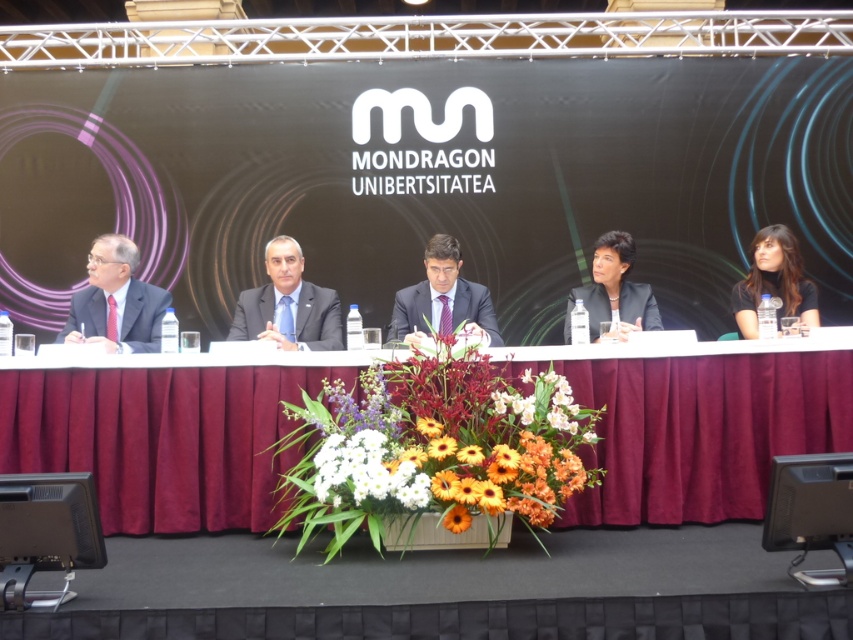
Does matte black suit at center lie in front of black matte business suit at right?

Yes, matte black suit at center is in front of black matte business suit at right.

From the picture: Can you confirm if matte black suit at center is positioned to the right of black matte business suit at right?

No, matte black suit at center is not to the right of black matte business suit at right.

The width and height of the screenshot is (853, 640). Identify the location of matte black suit at center. (317, 317).

Who is positioned more to the right, floral bouquet at center or black matte blazer at center?

Positioned to the right is black matte blazer at center.

Is point (399, 508) closer to camera compared to point (639, 292)?

That is True.

The image size is (853, 640). Describe the element at coordinates (436, 444) in the screenshot. I see `floral bouquet at center` at that location.

The height and width of the screenshot is (640, 853). Find the location of `floral bouquet at center`. floral bouquet at center is located at coordinates (436, 444).

Is black fabric at upper center bigger than dark blue fabric suit at center?

No, black fabric at upper center is not bigger than dark blue fabric suit at center.

Does black fabric at upper center have a greater width compared to dark blue fabric suit at center?

Correct, the width of black fabric at upper center exceeds that of dark blue fabric suit at center.

This screenshot has width=853, height=640. What are the coordinates of `black fabric at upper center` in the screenshot? It's located at click(x=428, y=180).

You are a GUI agent. You are given a task and a screenshot of the screen. Output one action in this format:
    pyautogui.click(x=<x>, y=<y>)
    Task: Click on the black fabric at upper center
    Image resolution: width=853 pixels, height=640 pixels.
    Given the screenshot: What is the action you would take?
    pyautogui.click(x=428, y=180)